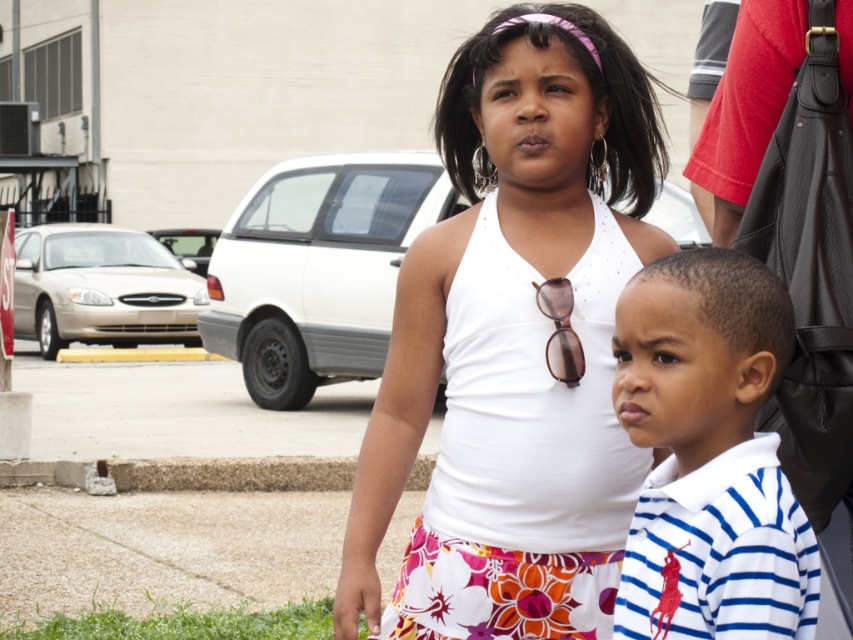
You are a photographer setting up for a group photo. You have two subjects wearing the white fabric dress at center and the white striped polo shirt at lower right. Based on their clothing, which subject should you position closer to the camera to ensure both appear equally sized in the photo?

The white fabric dress at center is wider than the white striped polo shirt at lower right, so you should position the subject in the white striped polo shirt at lower right closer to the camera to balance their apparent sizes.

You are a delivery robot that is 1.2 meters wide. You need to move from the white fabric dress at center to the gray concrete curb at lower center. Is there enough space for you to pass through the area between them?

The distance between the white fabric dress at center and the gray concrete curb at lower center is 6.96 meters. Since the robot is 1.2 meters wide, there is sufficient space to pass through the area between them as the distance is much larger than the robot width.